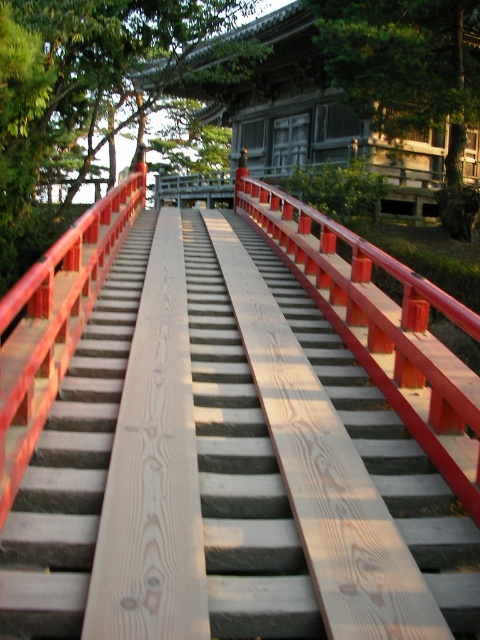
Question: Which point is closer to the camera?

Choices:
 (A) (346, 16)
 (B) (11, 600)

Answer: (B)

Question: Among these points, which one is farthest from the camera?

Choices:
 (A) (467, 108)
 (B) (46, 70)

Answer: (A)

Question: Is wooden stairs at center closer to camera compared to green leafy tree at upper center?

Choices:
 (A) yes
 (B) no

Answer: (A)

Question: Can you confirm if wooden stairs at center is positioned to the right of green leafy tree at upper center?

Choices:
 (A) no
 (B) yes

Answer: (A)

Question: Can you confirm if wooden stairs at center is positioned below green leafy tree at upper left?

Choices:
 (A) no
 (B) yes

Answer: (B)

Question: Which of the following is the closest to the observer?

Choices:
 (A) green leafy tree at upper left
 (B) green leafy tree at upper center

Answer: (A)